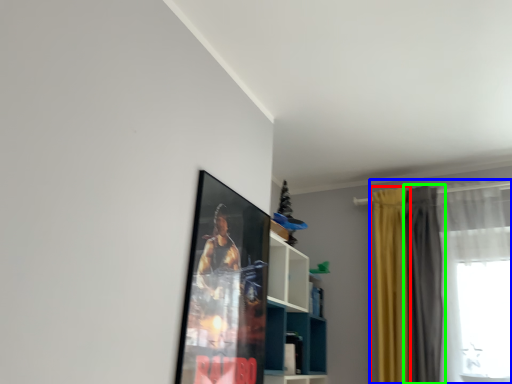
Question: Which is farther away from curtain (highlighted by a red box)? curtain (highlighted by a blue box) or curtain (highlighted by a green box)?

Choices:
 (A) curtain
 (B) curtain

Answer: (A)